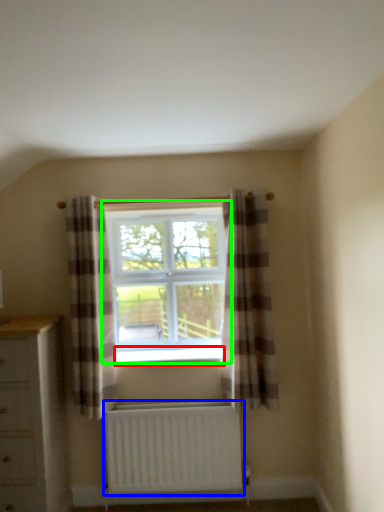
Question: Which object is the farthest from window sill (highlighted by a red box)? Choose among these: radiator (highlighted by a blue box) or window (highlighted by a green box).

Choices:
 (A) radiator
 (B) window

Answer: (A)